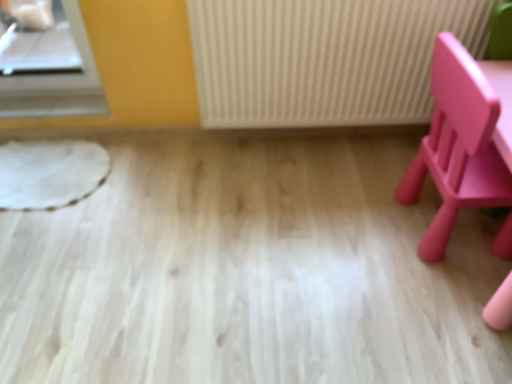
Question: Is matte pink chair at right to the right of white textured radiator at center from the viewer's perspective?

Choices:
 (A) no
 (B) yes

Answer: (B)

Question: Is matte pink chair at right oriented towards white textured radiator at center?

Choices:
 (A) no
 (B) yes

Answer: (A)

Question: From the image's perspective, is matte pink chair at right above white textured radiator at center?

Choices:
 (A) yes
 (B) no

Answer: (B)

Question: Considering the relative sizes of matte pink chair at right and white textured radiator at center in the image provided, is matte pink chair at right bigger than white textured radiator at center?

Choices:
 (A) yes
 (B) no

Answer: (A)

Question: Does matte pink chair at right have a greater height compared to white textured radiator at center?

Choices:
 (A) yes
 (B) no

Answer: (A)

Question: Does matte pink chair at right have a lesser height compared to white textured radiator at center?

Choices:
 (A) yes
 (B) no

Answer: (B)

Question: Are white textured radiator at center and matte pink chair at right located far from each other?

Choices:
 (A) yes
 (B) no

Answer: (B)

Question: Is white textured radiator at center positioned beyond the bounds of matte pink chair at right?

Choices:
 (A) no
 (B) yes

Answer: (B)

Question: Does white textured radiator at center have a larger size compared to matte pink chair at right?

Choices:
 (A) no
 (B) yes

Answer: (A)

Question: Can you confirm if white textured radiator at center is smaller than matte pink chair at right?

Choices:
 (A) yes
 (B) no

Answer: (A)

Question: From a real-world perspective, is white textured radiator at center located beneath matte pink chair at right?

Choices:
 (A) no
 (B) yes

Answer: (A)

Question: Is matte pink chair at right surrounded by white textured radiator at center?

Choices:
 (A) no
 (B) yes

Answer: (A)

Question: Based on their sizes in the image, would you say matte pink chair at right is bigger or smaller than white textured radiator at center?

Choices:
 (A) big
 (B) small

Answer: (A)